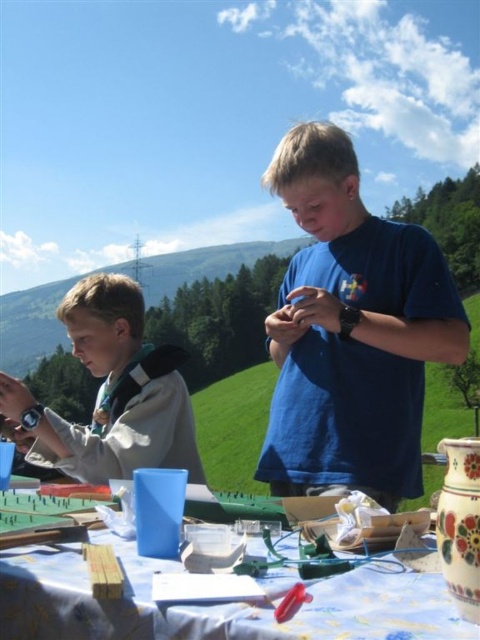
Where is `blue matte shirt at center`? Image resolution: width=480 pixels, height=640 pixels. blue matte shirt at center is located at coordinates (351, 332).

Between point (337, 195) and point (87, 365), which one is positioned in front?

Point (337, 195) is in front.

The width and height of the screenshot is (480, 640). What are the coordinates of `blue matte shirt at center` in the screenshot? It's located at (351, 332).

Image resolution: width=480 pixels, height=640 pixels. Identify the location of blue matte shirt at center. click(351, 332).

Is point (360, 417) farther from viewer compared to point (408, 612)?

Yes, point (360, 417) is behind point (408, 612).

Is point (262, 465) positioned behind point (8, 572)?

Yes.

At what (x,y) coordinates should I click in order to perform the action: click on blue matte shirt at center. Please return your answer as a coordinate pair (x, y). Image resolution: width=480 pixels, height=640 pixels. Looking at the image, I should click on (351, 332).

Can you confirm if wooden blocks at lower left is positioned to the left of white fleece jacket at left?

Incorrect, wooden blocks at lower left is not on the left side of white fleece jacket at left.

How far apart are wooden blocks at lower left and white fleece jacket at left?

The distance of wooden blocks at lower left from white fleece jacket at left is 1.13 meters.

Who is more forward, (x=44, y=584) or (x=107, y=468)?

Positioned in front is point (x=44, y=584).

The image size is (480, 640). What are the coordinates of `wooden blocks at lower left` in the screenshot? It's located at (215, 604).